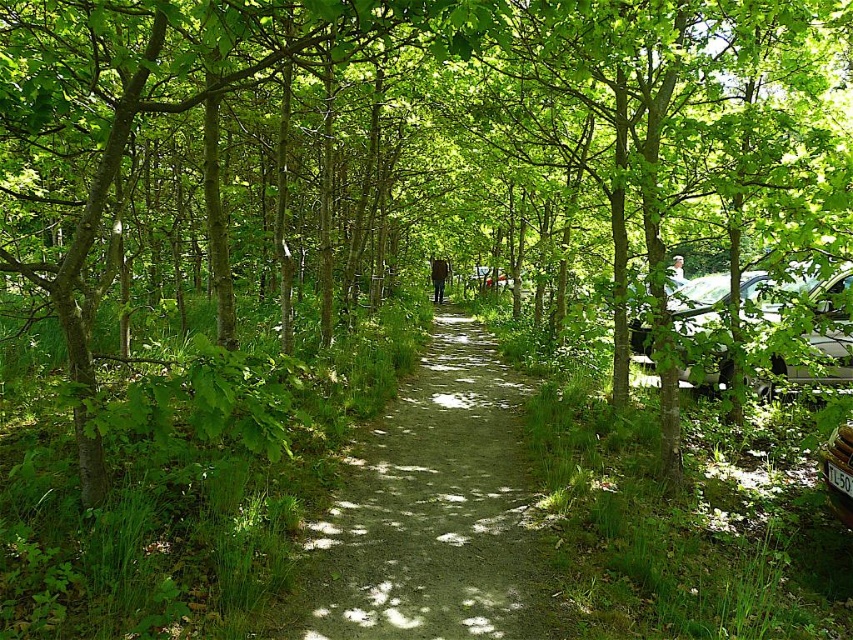
You are a hiker on the forest pathway and see two cars, a silver metallic car at right and a metallic silver car at right. Which one is positioned higher in the image?

The silver metallic car at right is positioned higher in the image than the metallic silver car at right.

You are standing at the start of the forest pathway and see the silver metallic car at right. If you want to walk towards the car, which direction should you head?

The silver metallic car at right is located at point 0.497 on the x axis and 0.955 on the y axis. Since the y coordinate is closer to 1, it is further along the pathway. To reach it, you should continue walking forward along the path towards the car.

Looking at this image, you are a hiker who wants to take a shortcut through the forest. You see the dirt path at center and the metallic silver car at right. Which one is closer to you?

The dirt path at center is closer because it is shorter than the metallic silver car at right.